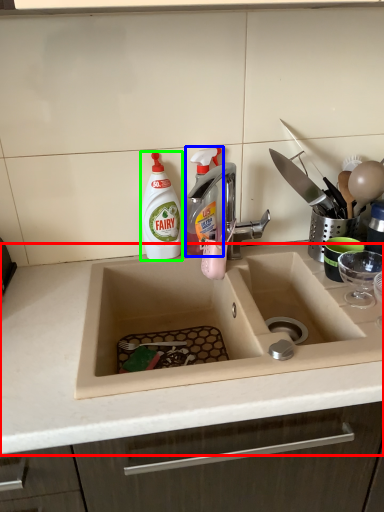
Question: Which is nearer to the countertop (highlighted by a red box)? cleaning product (highlighted by a blue box) or cleaning product (highlighted by a green box).

Choices:
 (A) cleaning product
 (B) cleaning product

Answer: (B)